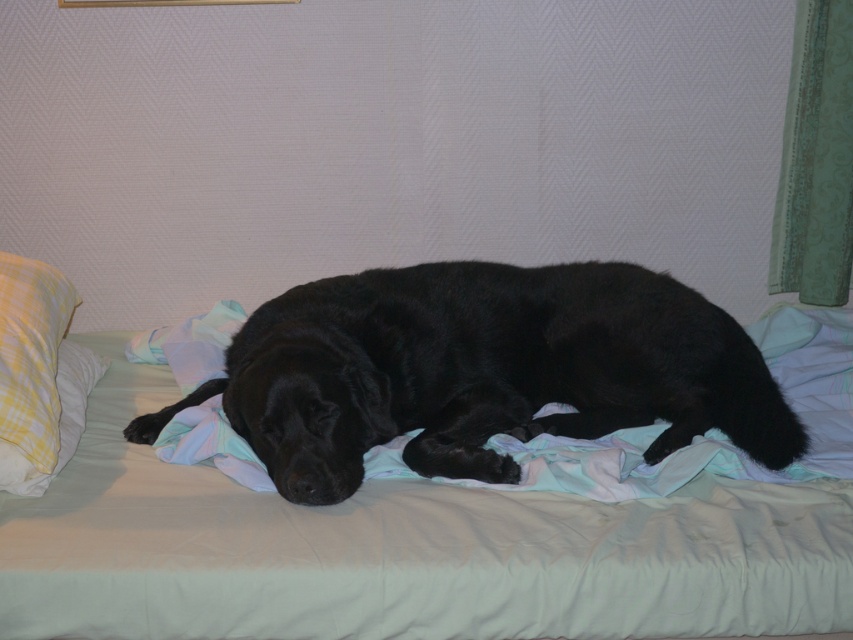
Consider the image. You are a photographer setting up a shoot in the room. You need to place a small light to the right of the silky black dog at center and to the left of the black soft fur dog at center. Is there enough space between them to place the light?

The silky black dog at center is positioned on the left side of the black soft fur dog at center, so there is space between them to place the light.

You are a pet sitter trying to place a new dog bed in the room. The current bed has limited space. Based on the image, which object takes up more horizontal space, the silky black dog at center or the yellow plaid pillow at left?

The silky black dog at center has a greater width than the yellow plaid pillow at left, so it occupies more horizontal space.